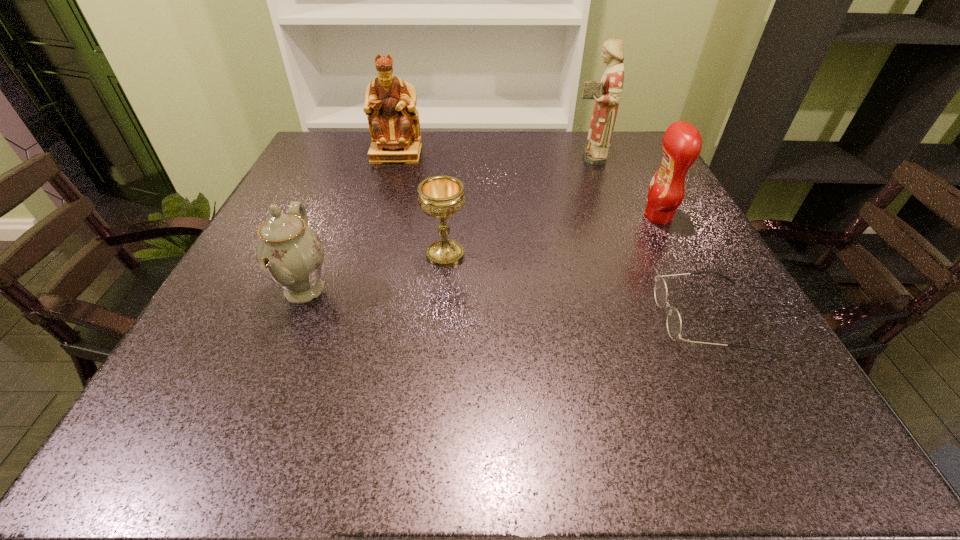
Identify the location of free location located 0.230m through the lenses of the spectacles. This screenshot has width=960, height=540. (524, 318).

Where is `object located at the left edge`? Image resolution: width=960 pixels, height=540 pixels. object located at the left edge is located at coordinates (289, 253).

Find the location of `figurine present at the right edge`. figurine present at the right edge is located at coordinates (607, 93).

The width and height of the screenshot is (960, 540). I want to click on condiment that is at the right edge, so click(682, 143).

This screenshot has width=960, height=540. What are the coordinates of `spectacles located at the right edge` in the screenshot? It's located at (674, 325).

I want to click on object at the far right corner, so point(607,93).

Where is `blank space at the far edge of the desktop`? This screenshot has width=960, height=540. blank space at the far edge of the desktop is located at coordinates (563, 154).

This screenshot has height=540, width=960. I want to click on vacant space at the near edge, so click(638, 397).

The width and height of the screenshot is (960, 540). Find the location of `vacant space at the left edge`. vacant space at the left edge is located at coordinates (252, 267).

Where is `free space at the right edge of the desktop`? free space at the right edge of the desktop is located at coordinates (635, 214).